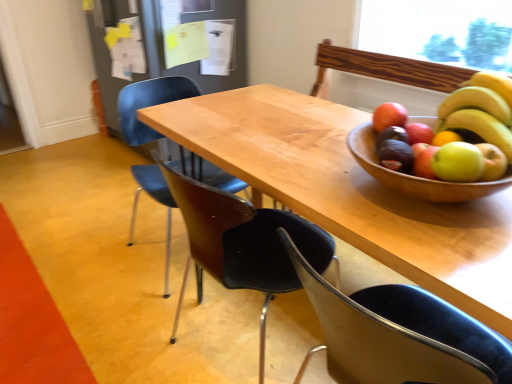
Question: From a real-world perspective, is yellow matte bananas at upper right positioned under matte black chair at center, positioned as the third chair in front-to-back order, based on gravity?

Choices:
 (A) no
 (B) yes

Answer: (A)

Question: From the image's perspective, is yellow matte bananas at upper right over matte black chair at center, positioned as the third chair in front-to-back order?

Choices:
 (A) no
 (B) yes

Answer: (B)

Question: Is yellow matte bananas at upper right wider than matte black chair at center, positioned as the third chair in front-to-back order?

Choices:
 (A) yes
 (B) no

Answer: (B)

Question: Can we say yellow matte bananas at upper right lies outside matte black chair at center, arranged as the 1th chair when viewed from the back?

Choices:
 (A) yes
 (B) no

Answer: (A)

Question: Is yellow matte bananas at upper right at the left side of matte black chair at center, arranged as the 1th chair when viewed from the back?

Choices:
 (A) yes
 (B) no

Answer: (B)

Question: Considering the positions of point (189, 94) and point (382, 317), is point (189, 94) closer or farther from the camera than point (382, 317)?

Choices:
 (A) closer
 (B) farther

Answer: (B)

Question: Would you say matte black chair at center, positioned as the third chair in front-to-back order, is inside or outside black plastic chair at lower right, which is the third chair in back-to-front order?

Choices:
 (A) outside
 (B) inside

Answer: (A)

Question: Looking at their shapes, would you say matte black chair at center, arranged as the 1th chair when viewed from the back, is wider or thinner than black plastic chair at lower right, placed as the first chair when sorted from front to back?

Choices:
 (A) thin
 (B) wide

Answer: (B)

Question: Based on their sizes in the image, would you say matte black chair at center, arranged as the 1th chair when viewed from the back, is bigger or smaller than black plastic chair at lower right, which is the third chair in back-to-front order?

Choices:
 (A) big
 (B) small

Answer: (A)

Question: Relative to natural wood table at center, is yellow matte bananas at upper right in front or behind?

Choices:
 (A) front
 (B) behind

Answer: (B)

Question: From their relative heights in the image, would you say yellow matte bananas at upper right is taller or shorter than natural wood table at center?

Choices:
 (A) short
 (B) tall

Answer: (A)

Question: From a real-world perspective, relative to natural wood table at center, is yellow matte bananas at upper right vertically above or below?

Choices:
 (A) below
 (B) above

Answer: (B)

Question: Do you think yellow matte bananas at upper right is within natural wood table at center, or outside of it?

Choices:
 (A) outside
 (B) inside

Answer: (A)

Question: Considering their positions, is natural wood table at center located in front of or behind green matte avocado at right, the 2th avocado in the front-to-back sequence?

Choices:
 (A) behind
 (B) front

Answer: (B)

Question: In the image, is natural wood table at center on the left side or the right side of green matte avocado at right, the 2th avocado in the front-to-back sequence?

Choices:
 (A) right
 (B) left

Answer: (B)